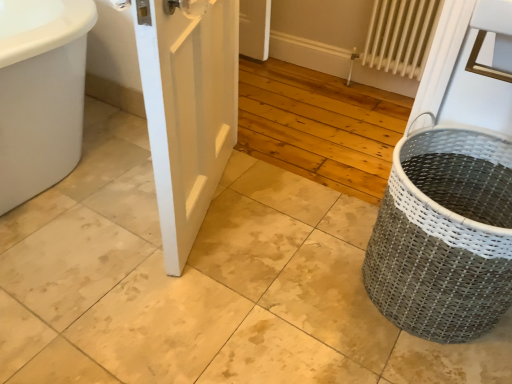
Question: Could you tell me if gray woven basket at right is turned towards white matte door at center?

Choices:
 (A) yes
 (B) no

Answer: (B)

Question: Does gray woven basket at right have a lesser width compared to white matte door at center?

Choices:
 (A) no
 (B) yes

Answer: (A)

Question: Is gray woven basket at right smaller than white matte door at center?

Choices:
 (A) yes
 (B) no

Answer: (A)

Question: Does gray woven basket at right have a larger size compared to white matte door at center?

Choices:
 (A) no
 (B) yes

Answer: (A)

Question: Is gray woven basket at right located outside white matte door at center?

Choices:
 (A) no
 (B) yes

Answer: (B)

Question: Is gray woven basket at right next to white matte door at center and touching it?

Choices:
 (A) no
 (B) yes

Answer: (A)

Question: Considering the relative sizes of white metal radiator at upper right and gray woven basket at right in the image provided, is white metal radiator at upper right smaller than gray woven basket at right?

Choices:
 (A) yes
 (B) no

Answer: (A)

Question: From a real-world perspective, does white metal radiator at upper right stand above gray woven basket at right?

Choices:
 (A) no
 (B) yes

Answer: (B)

Question: Can you confirm if white metal radiator at upper right is taller than gray woven basket at right?

Choices:
 (A) yes
 (B) no

Answer: (A)

Question: Is the position of white metal radiator at upper right more distant than that of gray woven basket at right?

Choices:
 (A) yes
 (B) no

Answer: (A)

Question: Is white metal radiator at upper right oriented towards gray woven basket at right?

Choices:
 (A) yes
 (B) no

Answer: (A)

Question: Considering the relative positions of white metal radiator at upper right and gray woven basket at right in the image provided, is white metal radiator at upper right to the right of gray woven basket at right from the viewer's perspective?

Choices:
 (A) no
 (B) yes

Answer: (B)

Question: Does white metal radiator at upper right have a larger size compared to white matte door at center?

Choices:
 (A) yes
 (B) no

Answer: (B)